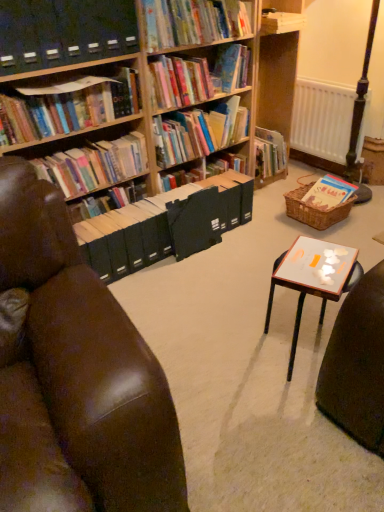
Question: Considering their positions, is hardcover book at upper center, the 4th book positioned from the right, located in front of or behind hardcover books at left, placed as the 2th book when sorted from left to right?

Choices:
 (A) behind
 (B) front

Answer: (B)

Question: In terms of height, does hardcover book at upper center, acting as the third book starting from the left, look taller or shorter compared to hardcover books at left, arranged as the 5th book when viewed from the right?

Choices:
 (A) short
 (B) tall

Answer: (A)

Question: Based on their relative distances, which object is farther from the hardcover books at upper center, the fifth book viewed from the left?

Choices:
 (A) black matte folder at center
 (B) brown leather chair at left
 (C) hardcover book at upper center, which is the 3th book from right to left
 (D) black plastic shelf at upper left
 (E) hardcover books at left, arranged as the 5th book when viewed from the right

Answer: (B)

Question: Which of these objects is positioned farthest from the brown leather chair at left?

Choices:
 (A) hardcover book at upper center, acting as the third book starting from the left
 (B) hardcover book at upper left, which is counted as the 1th book, starting from the left
 (C) hardcover books at upper center, which ranks as the 2th book in right-to-left order
 (D) black matte folder at center
 (E) white matte radiator at right

Answer: (E)